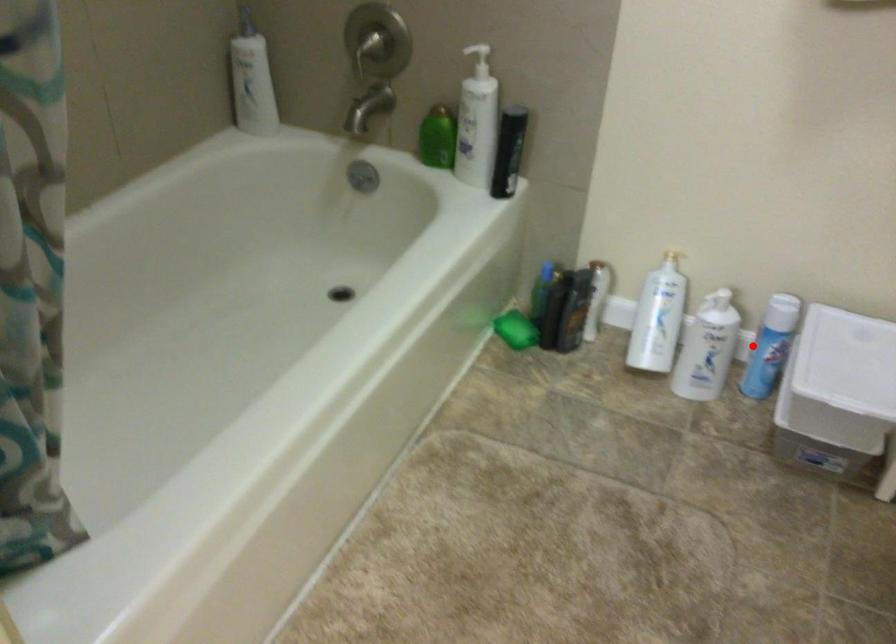
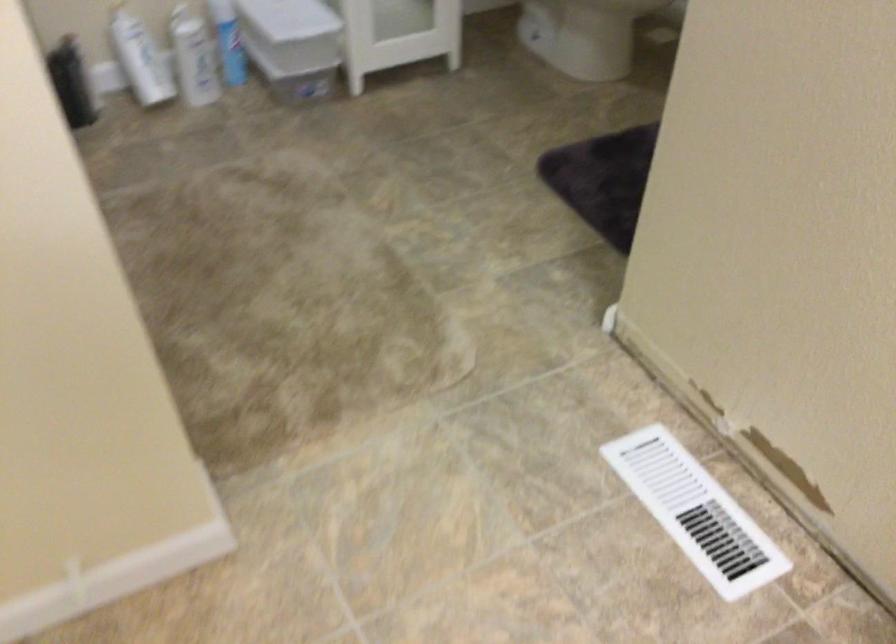
Question: I am providing you with two images of the same scene from different viewpoints. In image1, a red point is highlighted. Considering the same 3D point in image2, which of the following is correct?

Choices:
 (A) It is closer
 (B) It is farther

Answer: (B)